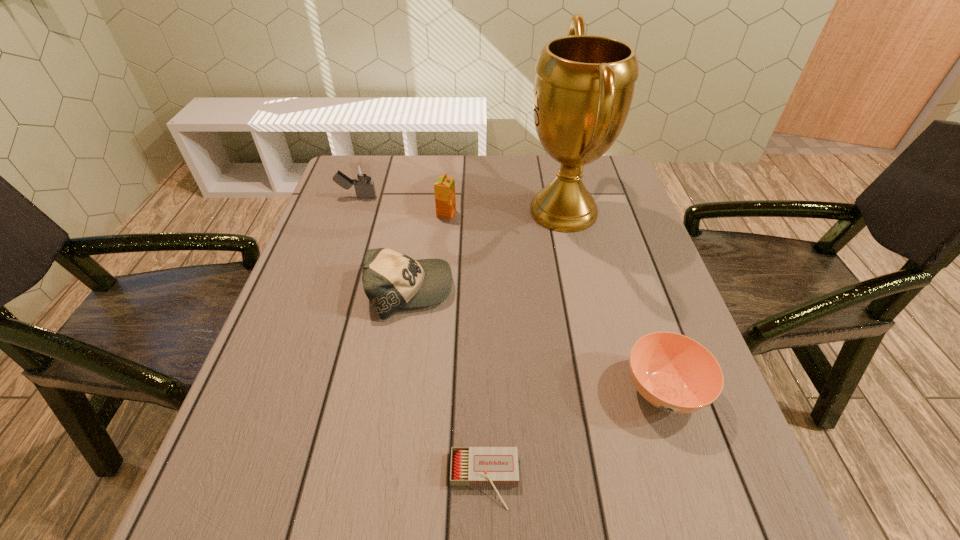
Find the location of a particular element. The image size is (960, 540). trophy cup is located at coordinates (584, 84).

I want to click on orange juice, so click(x=444, y=188).

You are a GUI agent. You are given a task and a screenshot of the screen. Output one action in this format:
    pyautogui.click(x=<x>, y=<y>)
    Task: Click on the leftmost object
    
    Given the screenshot: What is the action you would take?
    pyautogui.click(x=361, y=173)

The height and width of the screenshot is (540, 960). What are the coordinates of `baseball cap` in the screenshot? It's located at (391, 281).

Where is `soup bowl`? soup bowl is located at coordinates (674, 373).

Where is `matchbox`? This screenshot has height=540, width=960. matchbox is located at coordinates (470, 466).

Locate an element on the screen. This screenshot has height=540, width=960. the fourth object from left to right is located at coordinates (470, 466).

The height and width of the screenshot is (540, 960). Identify the location of vacant space situated 0.150m on the surface of the tallest object with symbols. (469, 212).

What are the coordinates of `vacant space located 0.310m on the surface of the tallest object with symbols` in the screenshot? It's located at (412, 212).

Identify the location of free space located 0.130m on the surface of the tallest object with symbols. (477, 212).